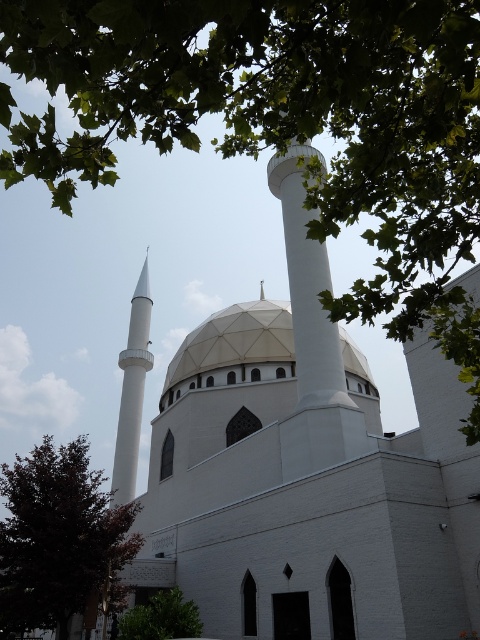
The height and width of the screenshot is (640, 480). In order to click on dark brown wood tree at lower left in this screenshot , I will do `click(59, 538)`.

Is dark brown wood tree at lower left below white textured dome at center?

Indeed, dark brown wood tree at lower left is positioned under white textured dome at center.

What do you see at coordinates (59, 538) in the screenshot? The height and width of the screenshot is (640, 480). I see `dark brown wood tree at lower left` at bounding box center [59, 538].

You are a GUI agent. You are given a task and a screenshot of the screen. Output one action in this format:
    pyautogui.click(x=<x>, y=<y>)
    Task: Click on the dark brown wood tree at lower left
    
    Given the screenshot: What is the action you would take?
    pyautogui.click(x=59, y=538)

Which is above, dark brown wood tree at lower left or white smooth minaret at center?

white smooth minaret at center

Can you confirm if dark brown wood tree at lower left is positioned to the left of white smooth minaret at center?

Yes, dark brown wood tree at lower left is to the left of white smooth minaret at center.

Which is behind, point (93, 576) or point (303, 246)?

Positioned behind is point (303, 246).

Locate an element on the screen. Image resolution: width=480 pixels, height=640 pixels. dark brown wood tree at lower left is located at coordinates (59, 538).

Can you confirm if white textured dome at center is positioned below white smooth minaret at center?

Correct, white textured dome at center is located below white smooth minaret at center.

In the scene shown: Is white textured dome at center above white smooth minaret at center?

No.

Is point (187, 380) positioned before point (325, 332)?

That is False.

You are a GUI agent. You are given a task and a screenshot of the screen. Output one action in this format:
    pyautogui.click(x=<x>, y=<y>)
    Task: Click on the white textured dome at center
    
    Given the screenshot: What is the action you would take?
    pyautogui.click(x=233, y=348)